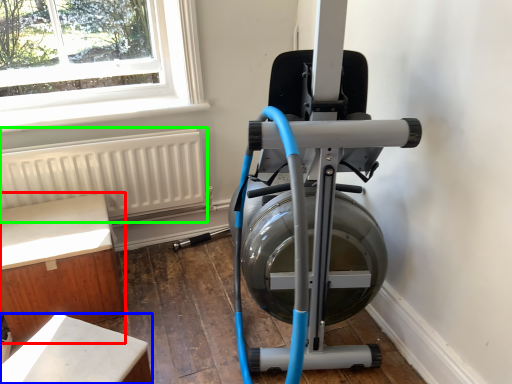
Question: Based on their relative distances, which object is nearer to furniture (highlighted by a red box)? Choose from furniture (highlighted by a blue box) and radiator (highlighted by a green box).

Choices:
 (A) furniture
 (B) radiator

Answer: (B)